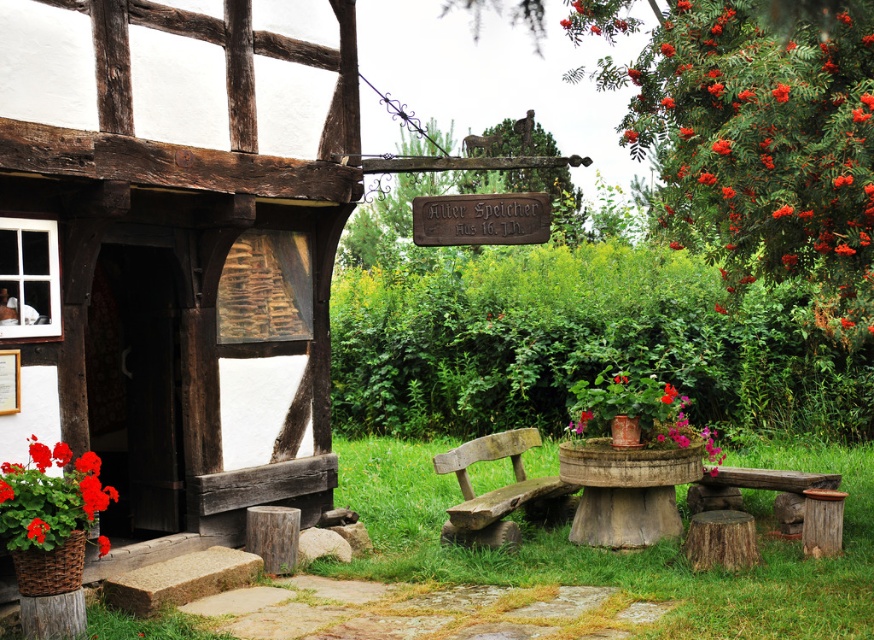
Does point (837, 74) come closer to viewer compared to point (29, 536)?

No.

Who is higher up, red berries at upper right or red matte flower at lower left?

red berries at upper right

Who is more distant from viewer, (817, 198) or (30, 525)?

The point (817, 198) is more distant.

Locate an element on the screen. The width and height of the screenshot is (874, 640). red berries at upper right is located at coordinates (762, 141).

From the picture: Can you confirm if rustic wooden bench at lower right is thinner than red matte flower at lower left?

In fact, rustic wooden bench at lower right might be wider than red matte flower at lower left.

The width and height of the screenshot is (874, 640). Describe the element at coordinates (758, 486) in the screenshot. I see `rustic wooden bench at lower right` at that location.

Is point (727, 484) closer to camera compared to point (35, 518)?

No, it is not.

Image resolution: width=874 pixels, height=640 pixels. In order to click on rustic wooden bench at lower right in this screenshot , I will do `click(758, 486)`.

Is point (30, 524) positioned before point (11, 486)?

Yes.

Who is more forward, [30,534] or [2,481]?

Point [30,534]

Who is more distant from viewer, (26,529) or (10,493)?

The point (10,493) is behind.

At what (x,y) coordinates should I click in order to perform the action: click on red matte flower at lower left. Please return your answer as a coordinate pair (x, y). Looking at the image, I should click on (37, 531).